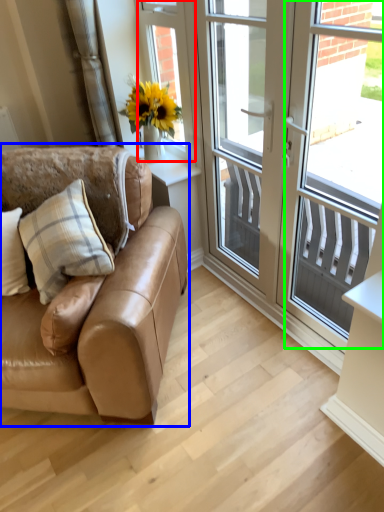
Question: Based on their relative distances, which object is nearer to window screen (highlighted by a red box)? Choose from studio couch (highlighted by a blue box) and window screen (highlighted by a green box).

Choices:
 (A) studio couch
 (B) window screen

Answer: (A)